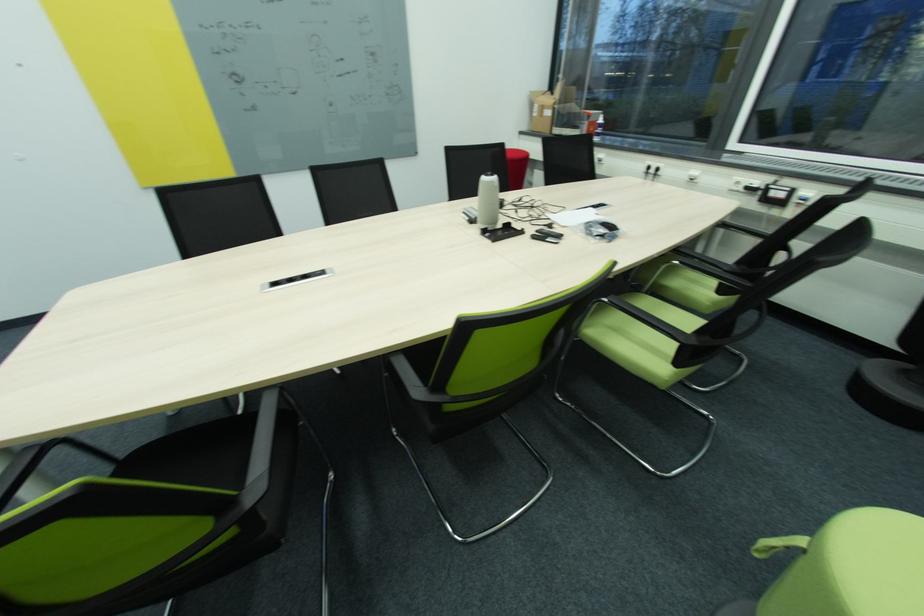
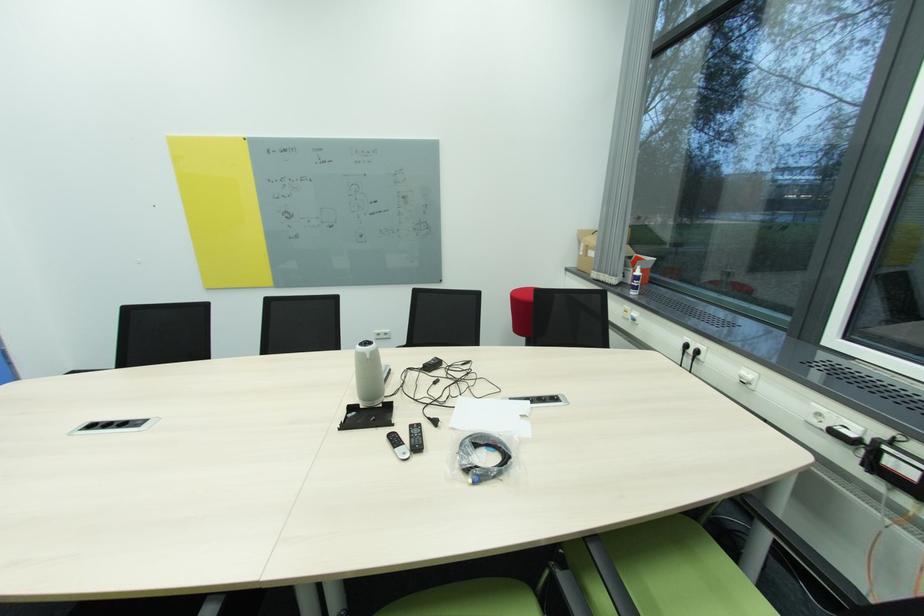
Find the pixel in the second image that matches (x=545, y=110) in the first image.

(591, 249)